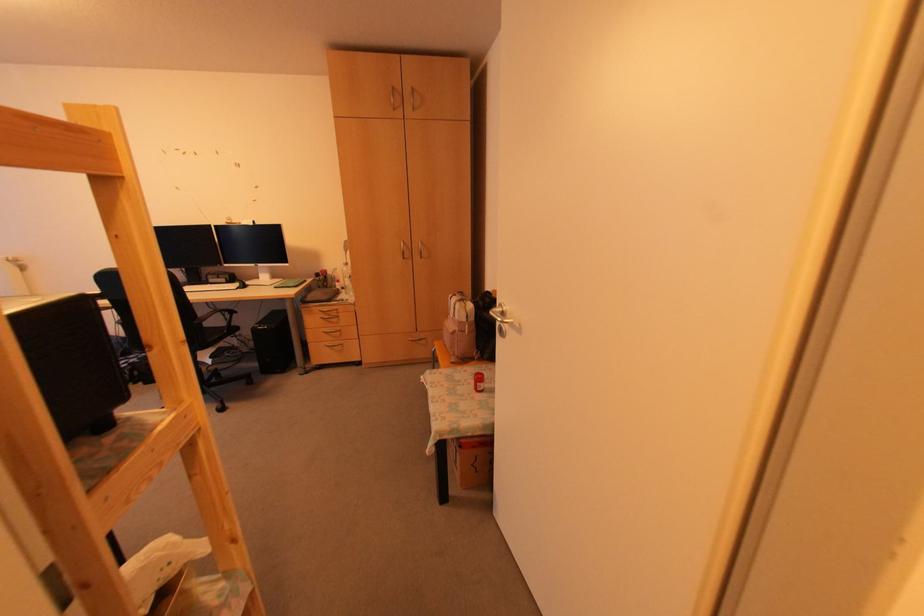
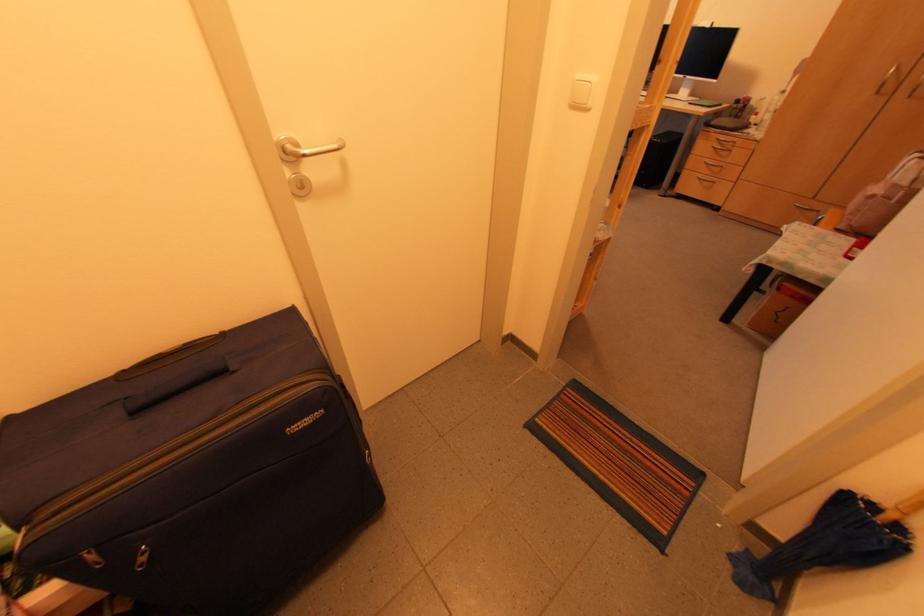
In the second image, find the point that corresponds to point 334,308 in the first image.

(734, 140)